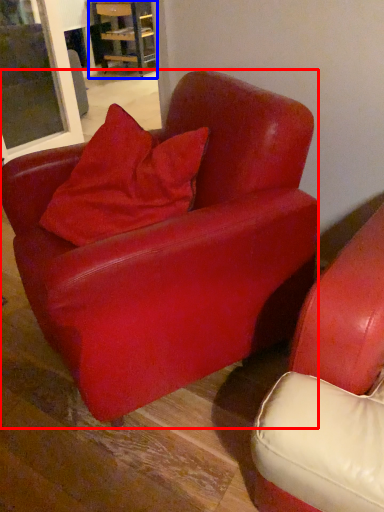
Question: Which of the following is the farthest to the observer, chair (highlighted by a red box) or table (highlighted by a blue box)?

Choices:
 (A) chair
 (B) table

Answer: (B)